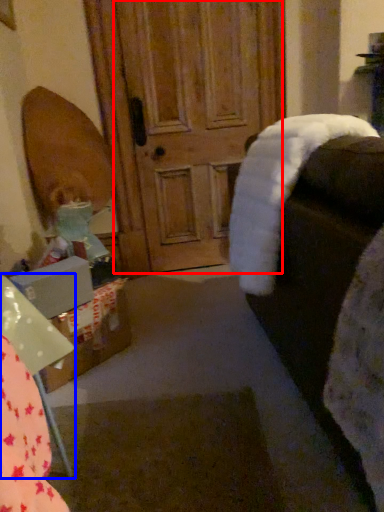
Question: Which object appears closest to the camera in this image, screen door (highlighted by a red box) or furniture (highlighted by a blue box)?

Choices:
 (A) screen door
 (B) furniture

Answer: (B)